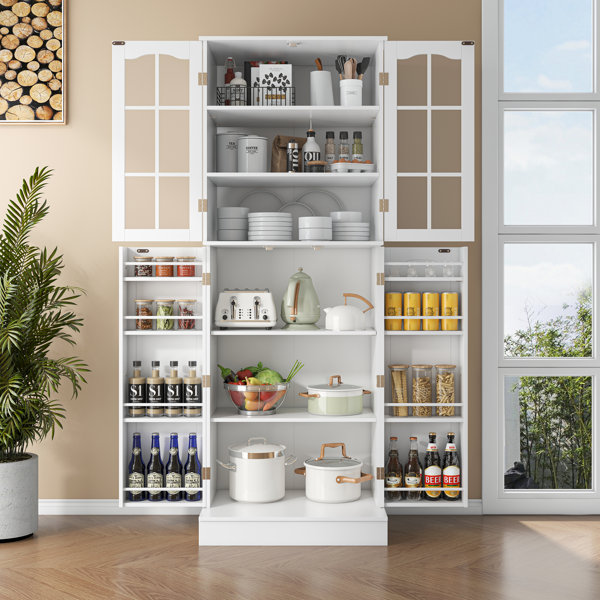
The image size is (600, 600). Identify the location of windows. (542, 441), (579, 264), (559, 170), (559, 81).